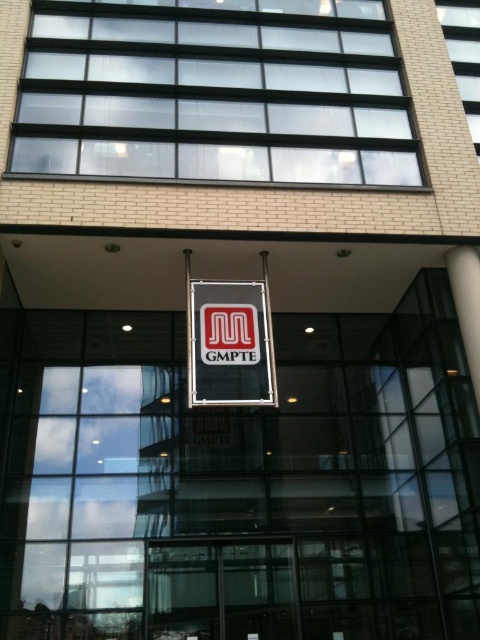
You are standing in front of the building and want to read the matte black sign at center. Is the sign located above or below the white glossy pillar at right?

The matte black sign at center is positioned under the white glossy pillar at right, so it is located below the pillar.

You are standing in front of the modern building and want to take a photo. There are two points marked on the banner, one at coordinates point (210, 339) and the other at point (472, 305). Which point will appear larger in your photo?

Point (210, 339) is closer to the camera than point (472, 305), so it will appear larger in the photo.

You are standing in front of the modern building and notice a point at coordinates (229, 344). What object is located at that point?

The point at coordinates (229, 344) is occupied by a matte black sign at center.